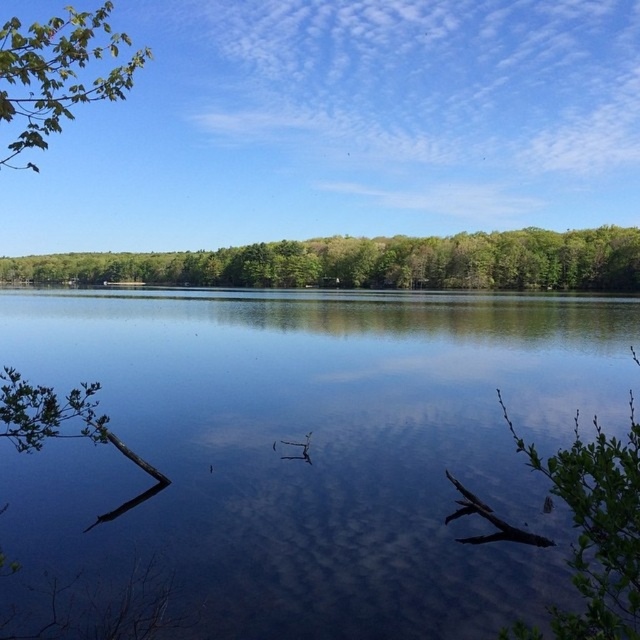
Which is behind, point (326, 378) or point (12, 90)?

Point (326, 378)

Who is shorter, transparent water at center or green leafy branch at upper left?

transparent water at center

Find the location of a particular element. The image size is (640, 640). transparent water at center is located at coordinates (314, 451).

Which is in front, point (625, 324) or point (45, 266)?

Point (625, 324) is in front.

Between transparent water at center and green leafy forest at upper center, which one appears on the right side from the viewer's perspective?

transparent water at center is more to the right.

Between point (225, 321) and point (586, 236), which one is positioned behind?

The point (586, 236) is more distant.

You are a GUI agent. You are given a task and a screenshot of the screen. Output one action in this format:
    pyautogui.click(x=<x>, y=<y>)
    Task: Click on the transparent water at center
    This screenshot has height=640, width=640.
    Given the screenshot: What is the action you would take?
    pyautogui.click(x=314, y=451)

Is green leafy forest at upper center closer to the viewer compared to green leafy branch at upper left?

That is False.

In order to click on green leafy forest at upper center in this screenshot , I will do `click(369, 262)`.

Between point (163, 264) and point (96, 28), which one is positioned in front?

Point (96, 28)

You are a GUI agent. You are given a task and a screenshot of the screen. Output one action in this format:
    pyautogui.click(x=<x>, y=<y>)
    Task: Click on the green leafy forest at upper center
    
    Given the screenshot: What is the action you would take?
    pyautogui.click(x=369, y=262)